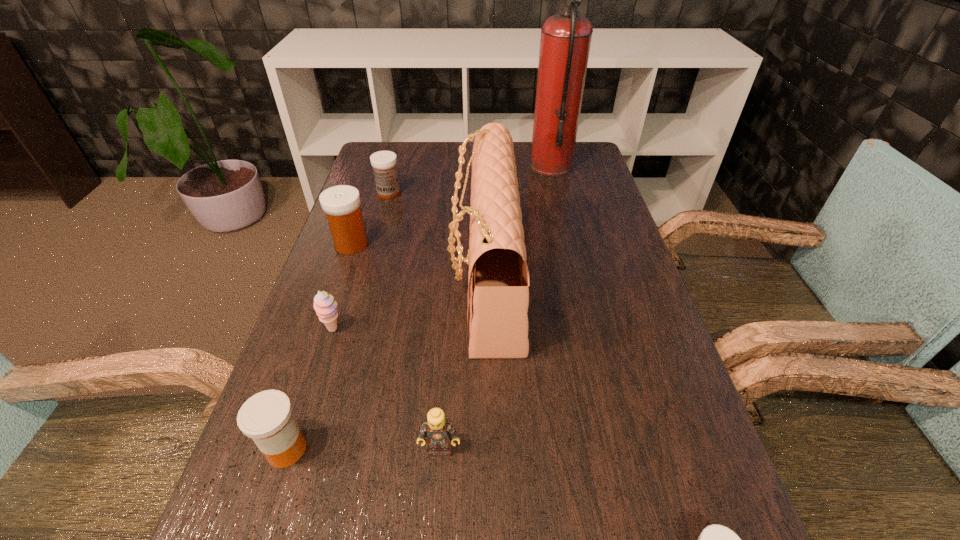
You are a GUI agent. You are given a task and a screenshot of the screen. Output one action in this format:
    pyautogui.click(x=<x>, y=<y>)
    Task: Click on the fire extinguisher
    The image size is (960, 540).
    Given the screenshot: What is the action you would take?
    pyautogui.click(x=565, y=41)

Find the location of a particular element. the farthest object is located at coordinates (565, 41).

At what (x,y) coordinates should I click in order to perform the action: click on the seventh shortest object. Please return your answer as a coordinate pair (x, y). This screenshot has width=960, height=540. Looking at the image, I should click on (499, 274).

Where is `pink handbag`? The width and height of the screenshot is (960, 540). pink handbag is located at coordinates (499, 274).

Identify the location of the tallest medicine. Image resolution: width=960 pixels, height=540 pixels. (341, 204).

Identify the location of the second nearest white medicine. pos(341,204).

Identify the location of orange medicine. (266, 417).

The width and height of the screenshot is (960, 540). I want to click on the farthest white medicine, so click(x=384, y=163).

The image size is (960, 540). I want to click on the farthest medicine, so click(384, 163).

Where is `sherbert`? The width and height of the screenshot is (960, 540). sherbert is located at coordinates (325, 306).